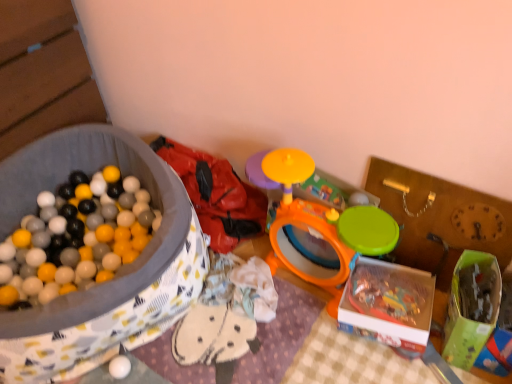
What do you see at coordinates (471, 308) in the screenshot? This screenshot has height=384, width=512. I see `green matte box at lower right` at bounding box center [471, 308].

Describe the element at coordinates (440, 219) in the screenshot. I see `green plastic storage box at center-right, positioned as the first storage box in right-to-left order` at that location.

Describe the element at coordinates (388, 304) in the screenshot. I see `translucent plastic box at lower right, the second storage box from the right` at that location.

Find the location of a particular element. Image resolution: width=512 pixels, height=384 pixels. matte fabric ball pit at left, the third storage box in the right-to-left sequence is located at coordinates (118, 270).

Image resolution: width=512 pixels, height=384 pixels. What do you see at coordinates (118, 270) in the screenshot? I see `matte fabric ball pit at left, positioned as the first storage box in left-to-right order` at bounding box center [118, 270].

Identify the location of green matte box at lower right. (471, 308).

What's the angular difference between green plastic storage box at center-right, positioned as the first storage box in right-to-left order, and matte fabric ball pit at left, positioned as the first storage box in left-to-right order,'s facing directions?

There is a 56-degree angle between the facing directions of green plastic storage box at center-right, positioned as the first storage box in right-to-left order, and matte fabric ball pit at left, positioned as the first storage box in left-to-right order.

From the image's perspective, which object appears higher, green plastic storage box at center-right, positioned as the first storage box in right-to-left order, or matte fabric ball pit at left, positioned as the first storage box in left-to-right order?

green plastic storage box at center-right, positioned as the first storage box in right-to-left order, appears higher in the image.

Could you tell me if green plastic storage box at center-right, which is the third storage box from left to right, is turned towards matte fabric ball pit at left, the third storage box in the right-to-left sequence?

No, green plastic storage box at center-right, which is the third storage box from left to right, is not oriented towards matte fabric ball pit at left, the third storage box in the right-to-left sequence.

Which is more to the right, translucent plastic box at lower right, the second storage box from the right, or white matte ball at lower left, which appears as the third toy when viewed from the right?

translucent plastic box at lower right, the second storage box from the right.

Is translucent plastic box at lower right, the second storage box from the left, not within white matte ball at lower left, which appears as the third toy when viewed from the right?

Indeed, translucent plastic box at lower right, the second storage box from the left, is completely outside white matte ball at lower left, which appears as the third toy when viewed from the right.

Considering the relative positions of translucent plastic box at lower right, the second storage box from the right, and white matte ball at lower left, the 1th toy in the left-to-right sequence, in the image provided, is translucent plastic box at lower right, the second storage box from the right, behind white matte ball at lower left, the 1th toy in the left-to-right sequence,?

No.

Identify the location of the 1st storage box to the right of the white matte ball at lower left, the 1th toy in the left-to-right sequence, counting from the anchor's position. This screenshot has width=512, height=384. (388, 304).

Is green plastic storage box at center-right, positioned as the first storage box in right-to-left order, at the left side of rubberized red jacket at upper left, which appears as the 2th toy when viewed from the left?

Incorrect, green plastic storage box at center-right, positioned as the first storage box in right-to-left order, is not on the left side of rubberized red jacket at upper left, which appears as the 2th toy when viewed from the left.

Considering the positions of point (432, 216) and point (215, 204), is point (432, 216) closer or farther from the camera than point (215, 204)?

Point (432, 216) is positioned closer to the camera compared to point (215, 204).

Does green plastic storage box at center-right, positioned as the first storage box in right-to-left order, have a lesser height compared to rubberized red jacket at upper left, which appears as the 2th toy when viewed from the left?

No, green plastic storage box at center-right, positioned as the first storage box in right-to-left order, is not shorter than rubberized red jacket at upper left, which appears as the 2th toy when viewed from the left.

Are translucent plastic box at lower right, the second storage box from the right, and green plastic storage box at center-right, positioned as the first storage box in right-to-left order, making contact?

No, translucent plastic box at lower right, the second storage box from the right, is not in contact with green plastic storage box at center-right, positioned as the first storage box in right-to-left order.

Is green plastic storage box at center-right, positioned as the first storage box in right-to-left order, a part of translucent plastic box at lower right, the second storage box from the right?

No, green plastic storage box at center-right, positioned as the first storage box in right-to-left order, is not inside translucent plastic box at lower right, the second storage box from the right.

Is translucent plastic box at lower right, the second storage box from the right, closer to camera compared to green plastic storage box at center-right, which is the third storage box from left to right?

No, translucent plastic box at lower right, the second storage box from the right, is behind green plastic storage box at center-right, which is the third storage box from left to right.

Consider the image. Which object is further away from the camera taking this photo, green matte box at lower right or green plastic storage box at center-right, which is the third storage box from left to right?

green plastic storage box at center-right, which is the third storage box from left to right, is more distant.

Between point (476, 306) and point (395, 177), which one is positioned in front?

The point (476, 306) is in front.

What's the angular difference between green matte box at lower right and green plastic storage box at center-right, positioned as the first storage box in right-to-left order,'s facing directions?

They differ by 3.96 degrees in their facing directions.

From the picture: In terms of width, does green matte box at lower right look wider or thinner when compared to green plastic storage box at center-right, positioned as the first storage box in right-to-left order?

green matte box at lower right is wider than green plastic storage box at center-right, positioned as the first storage box in right-to-left order.

Is white matte ball at lower left, which appears as the third toy when viewed from the right, closer to the viewer compared to green matte box at lower right?

No, white matte ball at lower left, which appears as the third toy when viewed from the right, is further to the viewer.

Is white matte ball at lower left, which appears as the third toy when viewed from the right, turned away from green matte box at lower right?

No, white matte ball at lower left, which appears as the third toy when viewed from the right, is not facing the opposite direction of green matte box at lower right.

Considering the relative sizes of white matte ball at lower left, which appears as the third toy when viewed from the right, and green matte box at lower right in the image provided, is white matte ball at lower left, which appears as the third toy when viewed from the right, thinner than green matte box at lower right?

Correct, the width of white matte ball at lower left, which appears as the third toy when viewed from the right, is less than that of green matte box at lower right.

From a real-world perspective, is white matte ball at lower left, which appears as the third toy when viewed from the right, on green matte box at lower right?

Actually, white matte ball at lower left, which appears as the third toy when viewed from the right, is physically below green matte box at lower right in the real world.

Is point (129, 366) farther from viewer compared to point (216, 221)?

No, it is in front of (216, 221).

Considering the positions of objects white matte ball at lower left, the 1th toy in the left-to-right sequence, and rubberized red jacket at upper left, positioned as the second toy in right-to-left order, in the image provided, who is more to the right, white matte ball at lower left, the 1th toy in the left-to-right sequence, or rubberized red jacket at upper left, positioned as the second toy in right-to-left order,?

Positioned to the right is rubberized red jacket at upper left, positioned as the second toy in right-to-left order.

Is white matte ball at lower left, the 1th toy in the left-to-right sequence, facing away from rubberized red jacket at upper left, which appears as the 2th toy when viewed from the left?

No, white matte ball at lower left, the 1th toy in the left-to-right sequence, is not facing the opposite direction of rubberized red jacket at upper left, which appears as the 2th toy when viewed from the left.

How distant is white matte ball at lower left, the 1th toy in the left-to-right sequence, from rubberized red jacket at upper left, positioned as the second toy in right-to-left order?

A distance of 71.21 centimeters exists between white matte ball at lower left, the 1th toy in the left-to-right sequence, and rubberized red jacket at upper left, positioned as the second toy in right-to-left order.

Identify the location of storage box that is the 1st object directly below the green plastic storage box at center-right, positioned as the first storage box in right-to-left order (from a real-world perspective). (118, 270).

Which toy is the 3rd one when counting from the left side of the translucent plastic box at lower right, the second storage box from the left? Please provide its 2D coordinates.

[(119, 367)]

Based on their spatial positions, is green matte box at lower right or rubberized red jacket at upper left, positioned as the second toy in right-to-left order, further from white matte ball at lower left, the 1th toy in the left-to-right sequence?

green matte box at lower right lies further to white matte ball at lower left, the 1th toy in the left-to-right sequence, than the other object.

Considering their positions, is white matte ball at lower left, the 1th toy in the left-to-right sequence, positioned closer to rubberized red jacket at upper left, positioned as the second toy in right-to-left order, than orange plastic drum at center, marked as the 1th toy in a right-to-left arrangement?

orange plastic drum at center, marked as the 1th toy in a right-to-left arrangement, is closer to rubberized red jacket at upper left, positioned as the second toy in right-to-left order.

When comparing their distances from matte fabric ball pit at left, positioned as the first storage box in left-to-right order, does orange plastic drum at center, the third toy from the left, or translucent plastic box at lower right, the second storage box from the left, seem further?

Among the two, translucent plastic box at lower right, the second storage box from the left, is located further to matte fabric ball pit at left, positioned as the first storage box in left-to-right order.

Based on their spatial positions, is orange plastic drum at center, the third toy from the left, or green matte box at lower right further from white matte ball at lower left, the 1th toy in the left-to-right sequence?

The object further to white matte ball at lower left, the 1th toy in the left-to-right sequence, is green matte box at lower right.

Which object lies nearer to the anchor point orange plastic drum at center, marked as the 1th toy in a right-to-left arrangement, translucent plastic box at lower right, the second storage box from the left, or green plastic storage box at center-right, which is the third storage box from left to right?

Based on the image, green plastic storage box at center-right, which is the third storage box from left to right, appears to be nearer to orange plastic drum at center, marked as the 1th toy in a right-to-left arrangement.

Estimate the real-world distances between objects in this image. Which object is further from orange plastic drum at center, marked as the 1th toy in a right-to-left arrangement, green plastic storage box at center-right, positioned as the first storage box in right-to-left order, or white matte ball at lower left, the 1th toy in the left-to-right sequence?

white matte ball at lower left, the 1th toy in the left-to-right sequence.

Considering their positions, is orange plastic drum at center, the third toy from the left, positioned further to rubberized red jacket at upper left, positioned as the second toy in right-to-left order, than white matte ball at lower left, the 1th toy in the left-to-right sequence?

Among the two, white matte ball at lower left, the 1th toy in the left-to-right sequence, is located further to rubberized red jacket at upper left, positioned as the second toy in right-to-left order.

Considering their positions, is translucent plastic box at lower right, the second storage box from the right, positioned further to white matte ball at lower left, the 1th toy in the left-to-right sequence, than green plastic storage box at center-right, which is the third storage box from left to right?

green plastic storage box at center-right, which is the third storage box from left to right, is further to white matte ball at lower left, the 1th toy in the left-to-right sequence.

Locate an element on the screen. The height and width of the screenshot is (384, 512). storage box situated between white matte ball at lower left, which appears as the third toy when viewed from the right, and green plastic storage box at center-right, which is the third storage box from left to right, from left to right is located at coordinates (388, 304).

The image size is (512, 384). What are the coordinates of `box between green plastic storage box at center-right, positioned as the first storage box in right-to-left order, and translucent plastic box at lower right, the second storage box from the left, in the vertical direction` in the screenshot? It's located at (471, 308).

Where is `storage box between orange plastic drum at center, marked as the 1th toy in a right-to-left arrangement, and green plastic storage box at center-right, positioned as the first storage box in right-to-left order, in the horizontal direction`? storage box between orange plastic drum at center, marked as the 1th toy in a right-to-left arrangement, and green plastic storage box at center-right, positioned as the first storage box in right-to-left order, in the horizontal direction is located at coordinates (388, 304).

Locate an element on the screen. toy between rubberized red jacket at upper left, positioned as the second toy in right-to-left order, and green plastic storage box at center-right, which is the third storage box from left to right, from left to right is located at coordinates (318, 222).